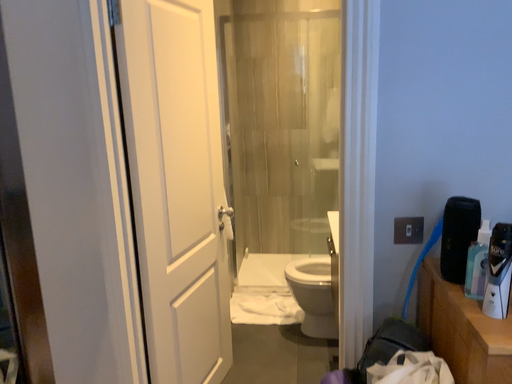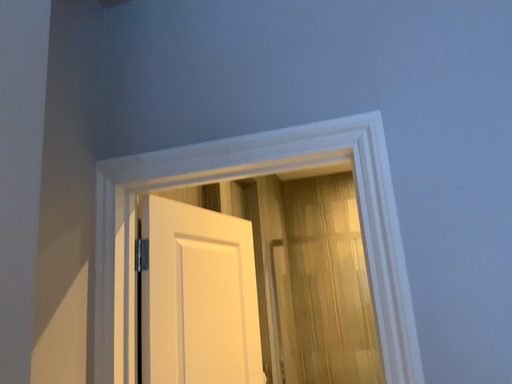
Question: Which way did the camera rotate in the video?

Choices:
 (A) rotated right
 (B) rotated left

Answer: (B)